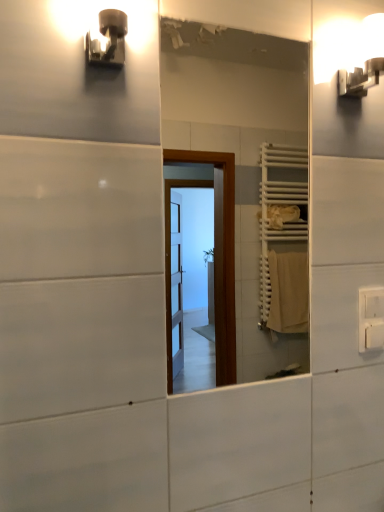
Question: Visually, is metallic wall sconce at upper left, which is the 2th light fixture from back to front, positioned to the left or to the right of white plastic electric outlet at upper right?

Choices:
 (A) left
 (B) right

Answer: (A)

Question: From their relative heights in the image, would you say metallic wall sconce at upper left, the second light fixture positioned from the right, is taller or shorter than white plastic electric outlet at upper right?

Choices:
 (A) tall
 (B) short

Answer: (B)

Question: Estimate the real-world distances between objects in this image. Which object is farther from the white glossy mirror at center?

Choices:
 (A) metallic wall sconce at upper left, which appears as the first light fixture when viewed from the left
 (B) white plastic electric outlet at upper right
 (C) white glossy wall sconce at upper right, arranged as the 1th light fixture when viewed from the back

Answer: (A)

Question: Which object is positioned farthest from the white glossy mirror at center?

Choices:
 (A) metallic wall sconce at upper left, which is the 2th light fixture from back to front
 (B) white glossy wall sconce at upper right, acting as the second light fixture starting from the front
 (C) white plastic electric outlet at upper right

Answer: (A)